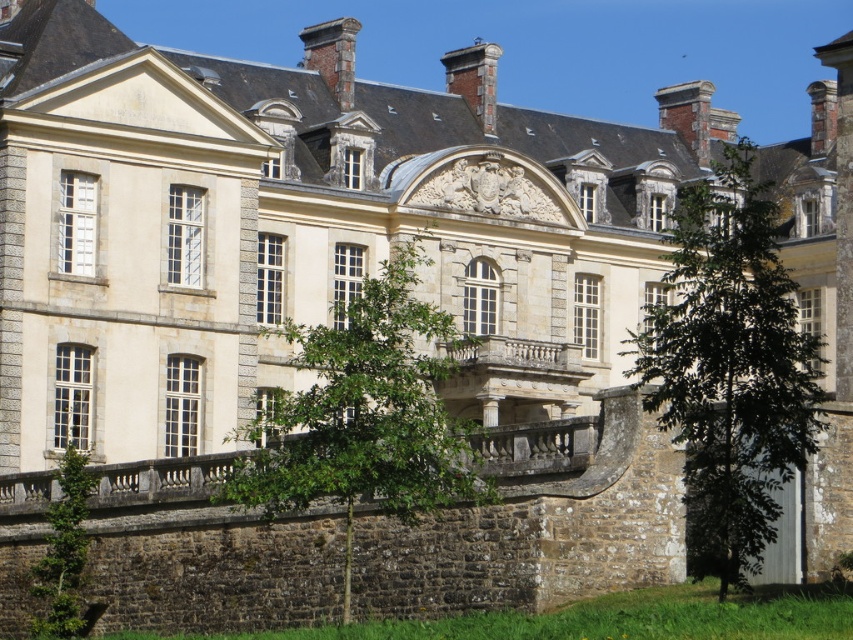
Is green leafy tree at right to the right of green leafy tree at center from the viewer's perspective?

Yes, green leafy tree at right is to the right of green leafy tree at center.

Can you confirm if green leafy tree at right is positioned to the left of green leafy tree at center?

In fact, green leafy tree at right is to the right of green leafy tree at center.

Measure the distance between point [654,304] and camera.

A distance of 103.28 meters exists between point [654,304] and camera.

Identify the location of green leafy tree at right. This screenshot has width=853, height=640. (730, 369).

Who is shorter, green leafy tree at center or green leafy tree at lower left?

With less height is green leafy tree at lower left.

Can you confirm if green leafy tree at center is positioned above green leafy tree at lower left?

Yes.

The image size is (853, 640). Identify the location of green leafy tree at center. (364, 412).

The height and width of the screenshot is (640, 853). Find the location of `green leafy tree at center`. green leafy tree at center is located at coordinates (364, 412).

Can you confirm if green leafy tree at right is shorter than green leafy tree at lower left?

No.

Is green leafy tree at right to the right of green leafy tree at lower left from the viewer's perspective?

Indeed, green leafy tree at right is positioned on the right side of green leafy tree at lower left.

Does point (767, 474) come in front of point (57, 557)?

That is True.

I want to click on green leafy tree at right, so click(x=730, y=369).